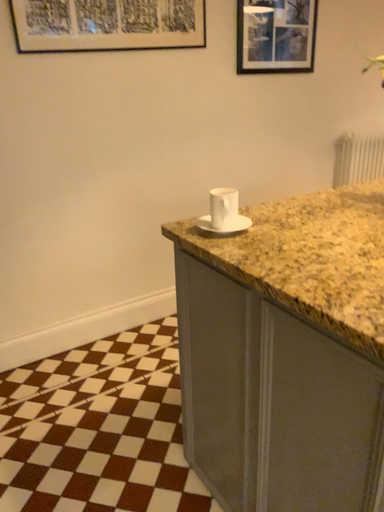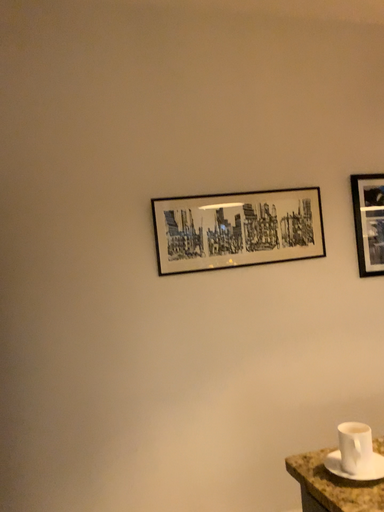
Question: Which way did the camera rotate in the video?

Choices:
 (A) rotated right
 (B) rotated left

Answer: (B)